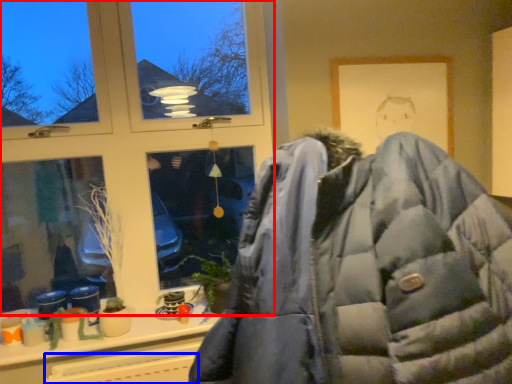
Question: Which object appears closest to the camera in this image, window (highlighted by a red box) or radiator (highlighted by a blue box)?

Choices:
 (A) window
 (B) radiator

Answer: (B)